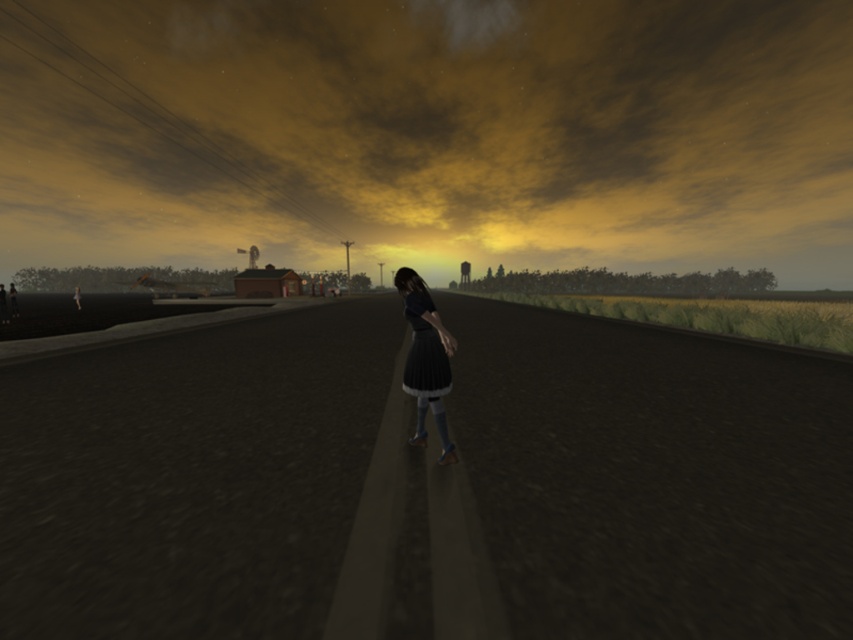
Between black asphalt train track at center and matte black dress at center, which one is positioned lower?

black asphalt train track at center

Is black asphalt train track at center positioned before matte black dress at center?

That is True.

Who is more forward, (x=213, y=570) or (x=428, y=308)?

Point (x=213, y=570) is in front.

Find the location of a particular element. The height and width of the screenshot is (640, 853). black asphalt train track at center is located at coordinates (426, 483).

Is cloudy sky at upper center wider than matte black dress at center?

Yes, cloudy sky at upper center is wider than matte black dress at center.

Who is positioned more to the left, cloudy sky at upper center or matte black dress at center?

cloudy sky at upper center is more to the left.

Is point (10, 65) farther from camera compared to point (427, 358)?

Yes, it is.

Identify the location of cloudy sky at upper center. (428, 132).

Does black asphalt train track at center have a greater height compared to cloudy sky at upper center?

Incorrect, black asphalt train track at center's height is not larger of cloudy sky at upper center's.

Who is more forward, (639, 365) or (0, 122)?

Point (639, 365) is in front.

Locate an element on the screen. This screenshot has width=853, height=640. black asphalt train track at center is located at coordinates (426, 483).